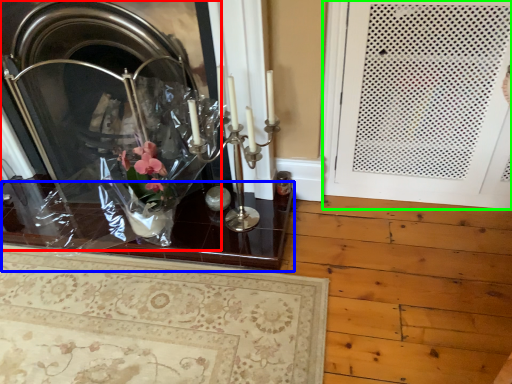
Question: Which object is positioned closest to fireplace (highlighted by a red box)? Select from table (highlighted by a blue box) and door (highlighted by a green box).

Choices:
 (A) table
 (B) door

Answer: (A)